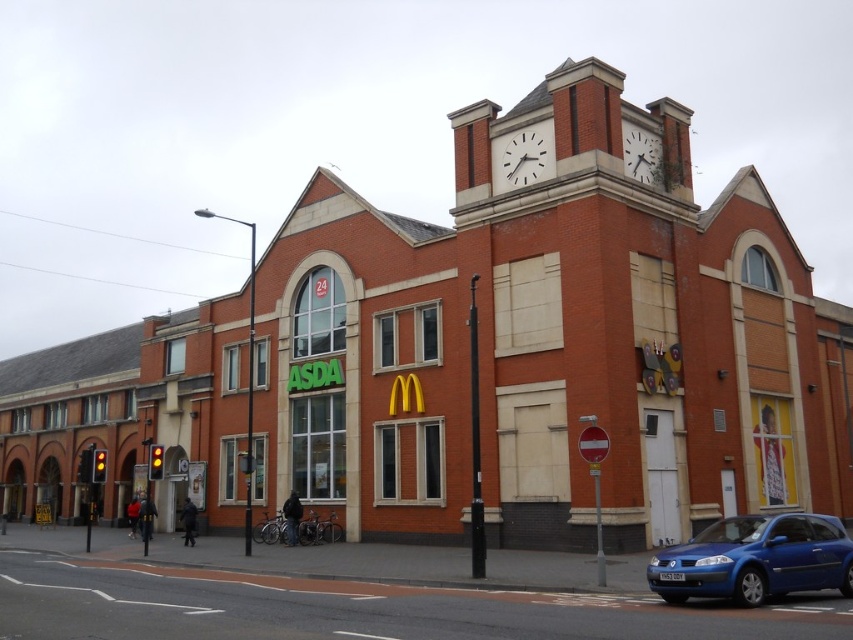
You are a photographer standing in front of the building. You want to capture both the blue metallic car at lower right and the white metallic clock at upper center in the same frame. Given their sizes, which object should you focus on to ensure both fit clearly in the photo?

The blue metallic car at lower right is bigger than the white metallic clock at upper center, so you should focus on the blue metallic car at lower right to ensure both fit clearly in the photo.

You are standing at the corner of the building with the ASDA and McDonald signs. There is a blue metallic car at lower right. Can you see the car from your current position?

Yes, the blue metallic car at lower right is located at point (755, 560), which is within your field of view from the corner of the building.

You are a delivery driver who needs to park your blue metallic car at lower right near the white metallic clock at upper center. Considering the height difference between them, will the car block the view of the clock from the street?

The blue metallic car at lower right is taller than the white metallic clock at upper center, so parking the car there would block the view of the clock from the street.